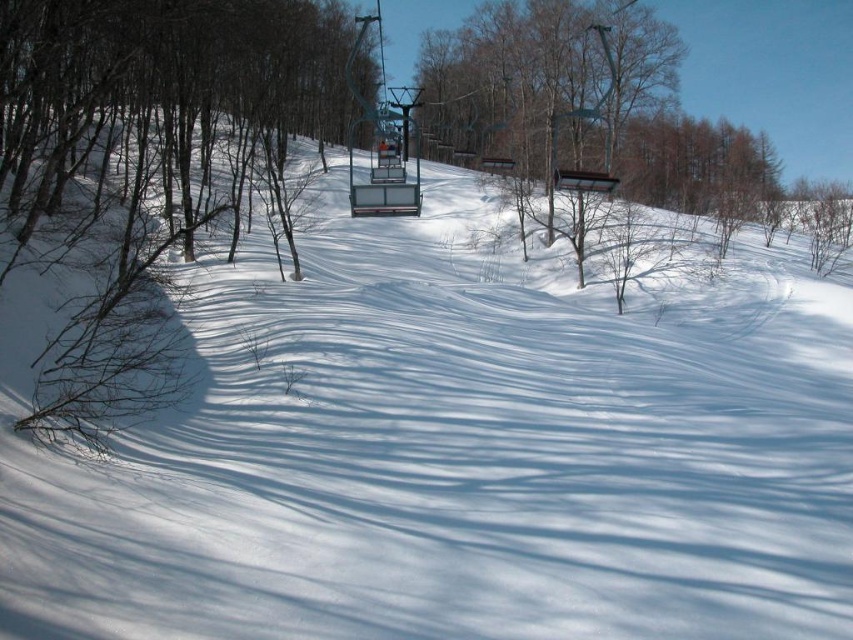
Question: Which of the following is the closest to the observer?

Choices:
 (A) metallic blue ski lift at center
 (B) brown bark tree at left

Answer: (B)

Question: Does brown bark tree at left have a smaller size compared to metallic blue ski lift at center?

Choices:
 (A) no
 (B) yes

Answer: (A)

Question: From the image, what is the correct spatial relationship of brown bark tree at left in relation to metallic blue ski lift at center?

Choices:
 (A) above
 (B) below

Answer: (B)

Question: Among these objects, which one is farthest from the camera?

Choices:
 (A) brown bark tree at left
 (B) metallic blue ski lift at center

Answer: (B)

Question: Can you confirm if brown bark tree at left is thinner than metallic blue ski lift at center?

Choices:
 (A) no
 (B) yes

Answer: (A)